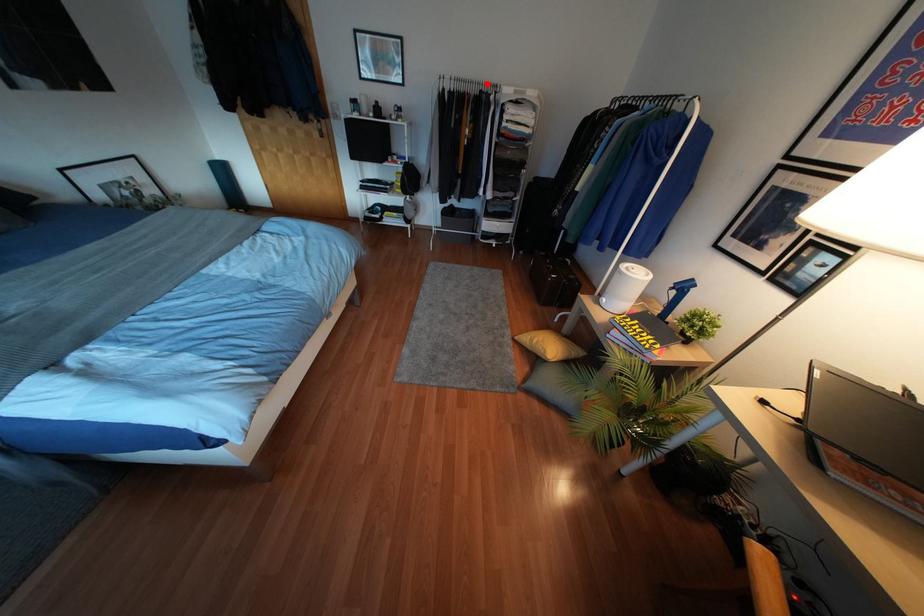
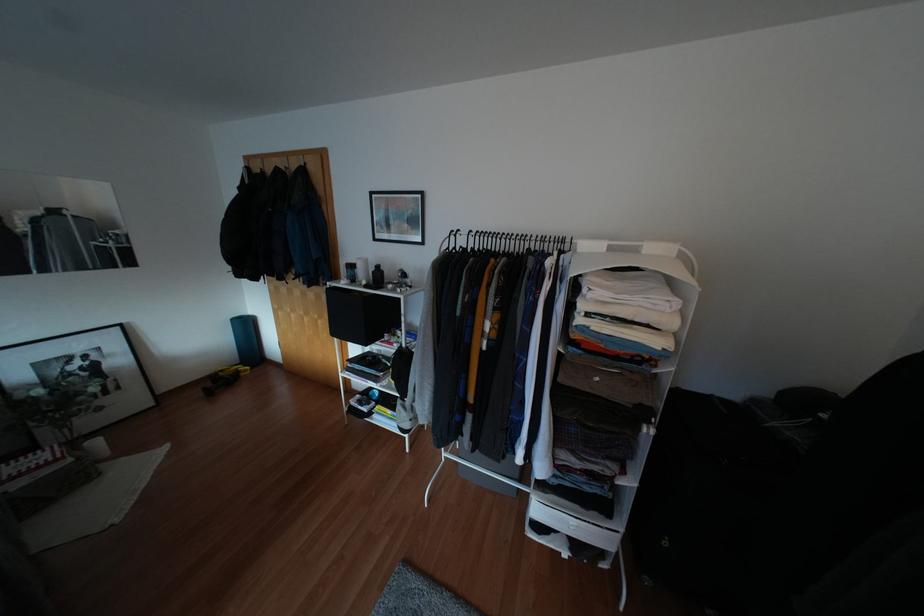
In the second image, find the point that corresponds to the highlighted location in the first image.

(542, 238)